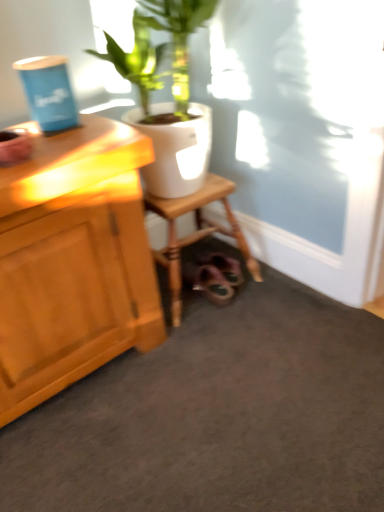
This screenshot has height=512, width=384. Describe the element at coordinates (172, 94) in the screenshot. I see `white glossy pot at upper center` at that location.

What is the approximate height of white glossy pot at upper center?

white glossy pot at upper center is 21.37 inches tall.

Image resolution: width=384 pixels, height=512 pixels. Identify the location of white glossy pot at upper center. (172, 94).

This screenshot has height=512, width=384. Describe the element at coordinates (196, 231) in the screenshot. I see `wooden stool at lower center` at that location.

What is the approximate width of wooden stool at lower center?

The width of wooden stool at lower center is 15.55 inches.

The image size is (384, 512). I want to click on wooden stool at lower center, so coord(196,231).

Find the location of a particular element. Image resolution: width=384 pixels, height=512 pixels. white glossy pot at upper center is located at coordinates (172, 94).

Which object is positioned more to the left, white glossy pot at upper center or wooden stool at lower center?

From the viewer's perspective, wooden stool at lower center appears more on the left side.

Is white glossy pot at upper center in front of or behind wooden stool at lower center in the image?

In the image, white glossy pot at upper center appears in front of wooden stool at lower center.

Considering the points (175, 25) and (175, 252), which point is behind, point (175, 25) or point (175, 252)?

The point (175, 252) is farther.

From the image's perspective, who appears lower, white glossy pot at upper center or wooden stool at lower center?

wooden stool at lower center is shown below in the image.

From a real-world perspective, who is located higher, white glossy pot at upper center or wooden stool at lower center?

From a 3D spatial view, white glossy pot at upper center is above.

Does white glossy pot at upper center have a lesser width compared to wooden stool at lower center?

Incorrect, the width of white glossy pot at upper center is not less than that of wooden stool at lower center.

Is white glossy pot at upper center shorter than wooden stool at lower center?

In fact, white glossy pot at upper center may be taller than wooden stool at lower center.

Looking at the image, does white glossy pot at upper center seem bigger or smaller compared to wooden stool at lower center?

Clearly, white glossy pot at upper center is larger in size than wooden stool at lower center.

Is white glossy pot at upper center not within wooden stool at lower center?

Indeed, white glossy pot at upper center is completely outside wooden stool at lower center.

Can you see white glossy pot at upper center touching wooden stool at lower center?

No, white glossy pot at upper center is not in contact with wooden stool at lower center.

Could you tell me if white glossy pot at upper center is turned towards wooden stool at lower center?

No, white glossy pot at upper center is not turned towards wooden stool at lower center.

What's the angular difference between white glossy pot at upper center and wooden stool at lower center's facing directions?

white glossy pot at upper center and wooden stool at lower center are facing 1.71 degrees away from each other.

Identify the location of stool below the white glossy pot at upper center (from a real-world perspective). (196, 231).

Can you confirm if wooden stool at lower center is positioned to the left of white glossy pot at upper center?

Indeed, wooden stool at lower center is positioned on the left side of white glossy pot at upper center.

Is wooden stool at lower center further to camera compared to white glossy pot at upper center?

Yes, wooden stool at lower center is behind white glossy pot at upper center.

Which is farther from the camera, (230, 208) or (141, 41)?

The point (230, 208) is more distant.

From the image's perspective, is wooden stool at lower center under white glossy pot at upper center?

Yes, from the image's perspective, wooden stool at lower center is beneath white glossy pot at upper center.

From a real-world perspective, which is physically above, wooden stool at lower center or white glossy pot at upper center?

In real-world perspective, white glossy pot at upper center is above.

Which object is thinner, wooden stool at lower center or white glossy pot at upper center?

wooden stool at lower center.

Who is taller, wooden stool at lower center or white glossy pot at upper center?

white glossy pot at upper center is taller.

Which of these two, wooden stool at lower center or white glossy pot at upper center, is smaller?

Smaller between the two is wooden stool at lower center.

Would you say wooden stool at lower center is inside or outside white glossy pot at upper center?

The correct answer is: outside.

Is wooden stool at lower center not near white glossy pot at upper center?

No.

Is wooden stool at lower center turned away from white glossy pot at upper center?

No, white glossy pot at upper center is not at the back of wooden stool at lower center.

Where is `houseplant lying in front of the wooden stool at lower center`? houseplant lying in front of the wooden stool at lower center is located at coordinates (172, 94).

This screenshot has height=512, width=384. I want to click on stool lying below the white glossy pot at upper center (from the image's perspective), so click(x=196, y=231).

Identify the location of stool located behind the white glossy pot at upper center. The height and width of the screenshot is (512, 384). coord(196,231).